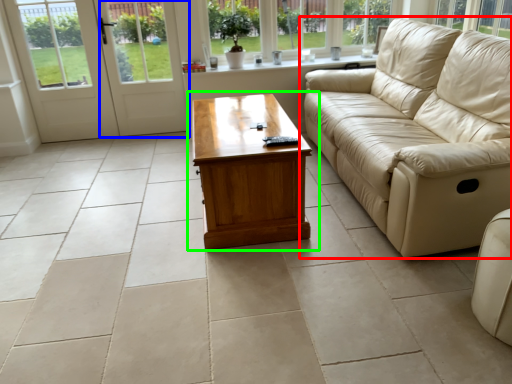
Question: Which object is positioned farthest from studio couch (highlighted by a red box)? Select from screen door (highlighted by a blue box) and coffee table (highlighted by a green box).

Choices:
 (A) screen door
 (B) coffee table

Answer: (A)